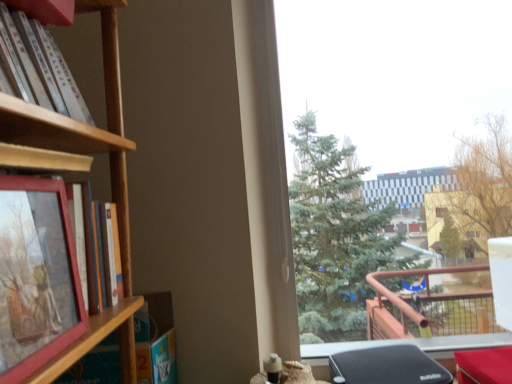
Question: From the image's perspective, is white matte book at upper left, which ranks as the second book in bottom-to-top order, above or below wooden shelf at left?

Choices:
 (A) above
 (B) below

Answer: (A)

Question: Is white matte book at upper left, arranged as the 1th book when viewed from the top, wider or thinner than wooden shelf at left?

Choices:
 (A) thin
 (B) wide

Answer: (A)

Question: Estimate the real-world distances between objects in this image. Which object is closer to the matte wooden book at left, which is the second book from top to bottom?

Choices:
 (A) matte wooden picture frame at left
 (B) wooden shelf at left
 (C) white matte book at upper left, arranged as the 1th book when viewed from the top
 (D) transparent glass window at upper right

Answer: (B)

Question: Which object is positioned closest to the matte wooden book at left, marked as the first book in a bottom-to-top arrangement?

Choices:
 (A) white matte book at upper left, arranged as the 1th book when viewed from the top
 (B) transparent glass window at upper right
 (C) wooden shelf at left
 (D) matte wooden picture frame at left

Answer: (C)